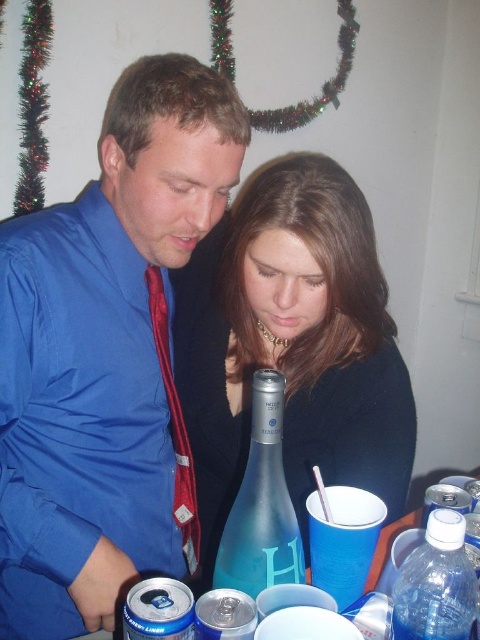
Question: Which of the following is the closest to the observer?

Choices:
 (A) translucent plastic water bottle at lower right
 (B) matte blue glass bottle at center
 (C) blue satin shirt at center
 (D) blue glass bottle at center

Answer: (A)

Question: Is blue satin shirt at center behind matte blue glass bottle at center?

Choices:
 (A) no
 (B) yes

Answer: (A)

Question: Which point appears closest to the camera in this image?

Choices:
 (A) (151, 209)
 (B) (406, 570)
 (C) (228, 548)

Answer: (C)

Question: Which object is closer to the camera taking this photo?

Choices:
 (A) blue glass bottle at center
 (B) matte blue glass bottle at center
 (C) translucent plastic water bottle at lower right
 (D) blue satin shirt at center

Answer: (C)

Question: Does blue satin shirt at center have a larger size compared to translucent plastic water bottle at lower right?

Choices:
 (A) yes
 (B) no

Answer: (A)

Question: Does matte blue glass bottle at center appear over translucent plastic water bottle at lower right?

Choices:
 (A) no
 (B) yes

Answer: (B)